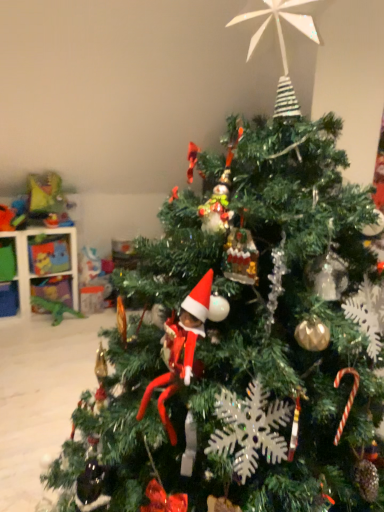
The height and width of the screenshot is (512, 384). What do you see at coordinates (44, 261) in the screenshot?
I see `white plastic shelf at left` at bounding box center [44, 261].

The height and width of the screenshot is (512, 384). What do you see at coordinates (41, 203) in the screenshot?
I see `plastic dinosaur at upper left, the first toy viewed from the top` at bounding box center [41, 203].

Find the location of a particular element. Image resolution: width=384 pixels, height=512 pixels. white plastic shelf at left is located at coordinates (44, 261).

Between plastic dinosaur at upper left, the first toy viewed from the top, and white plastic shelf at left, which one appears on the right side from the viewer's perspective?

plastic dinosaur at upper left, the first toy viewed from the top, is more to the right.

From a real-world perspective, is plastic dinosaur at upper left, the first toy viewed from the top, above or below white plastic shelf at left?

In terms of real-world spatial position, plastic dinosaur at upper left, the first toy viewed from the top, is above white plastic shelf at left.

Is plastic dinosaur at upper left, which ranks as the second toy in bottom-to-top order, completely or partially outside of white plastic shelf at left?

plastic dinosaur at upper left, which ranks as the second toy in bottom-to-top order, is positioned outside white plastic shelf at left.

How distant is plastic dinosaur at upper left, which ranks as the second toy in bottom-to-top order, from white plastic shelf at left?

plastic dinosaur at upper left, which ranks as the second toy in bottom-to-top order, is 10.46 inches from white plastic shelf at left.

Is white plastic shelf at left situated inside plastic dinosaur at upper left, which ranks as the second toy in bottom-to-top order, or outside?

white plastic shelf at left is located beyond the bounds of plastic dinosaur at upper left, which ranks as the second toy in bottom-to-top order.

Which object is thinner, white plastic shelf at left or plastic dinosaur at upper left, the first toy viewed from the top?

Thinner between the two is plastic dinosaur at upper left, the first toy viewed from the top.

Does point (13, 278) appear closer or farther from the camera than point (43, 204)?

Point (13, 278) is positioned closer to the camera compared to point (43, 204).

From the image's perspective, does white plastic shelf at left appear lower than plastic dinosaur at upper left, which ranks as the second toy in bottom-to-top order?

Indeed, from the image's perspective, white plastic shelf at left is shown beneath plastic dinosaur at upper left, which ranks as the second toy in bottom-to-top order.

Can you tell me how much white plastic shelf at left and green plastic dinosaur at lower left, marked as the first toy in a bottom-to-top arrangement, differ in facing direction?

The angle between the facing direction of white plastic shelf at left and the facing direction of green plastic dinosaur at lower left, marked as the first toy in a bottom-to-top arrangement, is 0.976 degrees.

Is point (35, 254) closer to viewer compared to point (54, 310)?

That is True.

Considering the sizes of white plastic shelf at left and green plastic dinosaur at lower left, marked as the first toy in a bottom-to-top arrangement, in the image, is white plastic shelf at left taller or shorter than green plastic dinosaur at lower left, marked as the first toy in a bottom-to-top arrangement,?

Considering their sizes, white plastic shelf at left has more height than green plastic dinosaur at lower left, marked as the first toy in a bottom-to-top arrangement.

Considering the relative positions of white plastic shelf at left and green plastic dinosaur at lower left, the 2th toy positioned from the top, in the image provided, is white plastic shelf at left to the right of green plastic dinosaur at lower left, the 2th toy positioned from the top, from the viewer's perspective?

Incorrect, white plastic shelf at left is not on the right side of green plastic dinosaur at lower left, the 2th toy positioned from the top.

Considering the relative positions of green plastic dinosaur at lower left, marked as the first toy in a bottom-to-top arrangement, and white plastic shelf at left in the image provided, is green plastic dinosaur at lower left, marked as the first toy in a bottom-to-top arrangement, to the left or to the right of white plastic shelf at left?

From the image, it's evident that green plastic dinosaur at lower left, marked as the first toy in a bottom-to-top arrangement, is to the right of white plastic shelf at left.

Is green plastic dinosaur at lower left, the 2th toy positioned from the top, positioned far away from white plastic shelf at left?

green plastic dinosaur at lower left, the 2th toy positioned from the top, is actually quite close to white plastic shelf at left.

Which object is wider, green plastic dinosaur at lower left, the 2th toy positioned from the top, or white plastic shelf at left?

white plastic shelf at left is wider.

Considering the relative positions of green plastic dinosaur at lower left, the 2th toy positioned from the top, and white plastic shelf at left in the image provided, is green plastic dinosaur at lower left, the 2th toy positioned from the top, behind white plastic shelf at left?

Yes, green plastic dinosaur at lower left, the 2th toy positioned from the top, is further from the camera.

Would you say plastic dinosaur at upper left, which ranks as the second toy in bottom-to-top order, contains green plastic dinosaur at lower left, the 2th toy positioned from the top?

Actually, green plastic dinosaur at lower left, the 2th toy positioned from the top, is outside plastic dinosaur at upper left, which ranks as the second toy in bottom-to-top order.

You are a GUI agent. You are given a task and a screenshot of the screen. Output one action in this format:
    pyautogui.click(x=<x>, y=<y>)
    Task: Click on the toy below the plastic dinosaur at upper left, the first toy viewed from the top (from a real-world perspective)
    The height and width of the screenshot is (512, 384).
    Given the screenshot: What is the action you would take?
    pyautogui.click(x=54, y=309)

How far apart are plastic dinosaur at upper left, which ranks as the second toy in bottom-to-top order, and green plastic dinosaur at lower left, the 2th toy positioned from the top?

plastic dinosaur at upper left, which ranks as the second toy in bottom-to-top order, is 29.17 inches from green plastic dinosaur at lower left, the 2th toy positioned from the top.

Is plastic dinosaur at upper left, the first toy viewed from the top, positioned far away from green plastic dinosaur at lower left, marked as the first toy in a bottom-to-top arrangement?

No, plastic dinosaur at upper left, the first toy viewed from the top, is not far away from green plastic dinosaur at lower left, marked as the first toy in a bottom-to-top arrangement.

Is green plastic dinosaur at lower left, marked as the first toy in a bottom-to-top arrangement, facing away from plastic dinosaur at upper left, which ranks as the second toy in bottom-to-top order?

green plastic dinosaur at lower left, marked as the first toy in a bottom-to-top arrangement, is not turned away from plastic dinosaur at upper left, which ranks as the second toy in bottom-to-top order.

From a real-world perspective, is green plastic dinosaur at lower left, marked as the first toy in a bottom-to-top arrangement, above or below plastic dinosaur at upper left, which ranks as the second toy in bottom-to-top order?

In terms of real-world spatial position, green plastic dinosaur at lower left, marked as the first toy in a bottom-to-top arrangement, is below plastic dinosaur at upper left, which ranks as the second toy in bottom-to-top order.

Where is `toy on the left of green plastic dinosaur at lower left, marked as the first toy in a bottom-to-top arrangement`? The image size is (384, 512). toy on the left of green plastic dinosaur at lower left, marked as the first toy in a bottom-to-top arrangement is located at coordinates [x=41, y=203].

Measure the distance from green plastic dinosaur at lower left, marked as the first toy in a bottom-to-top arrangement, to plastic dinosaur at upper left, the first toy viewed from the top.

green plastic dinosaur at lower left, marked as the first toy in a bottom-to-top arrangement, is 74.09 centimeters away from plastic dinosaur at upper left, the first toy viewed from the top.

Locate an element on the screen. This screenshot has height=512, width=384. shelf that is on the left side of plastic dinosaur at upper left, which ranks as the second toy in bottom-to-top order is located at coordinates (44, 261).

Find the location of a particular element. This screenshot has height=512, width=384. shelf below the plastic dinosaur at upper left, which ranks as the second toy in bottom-to-top order (from the image's perspective) is located at coordinates (44, 261).

Looking at the image, which one is located closer to white plastic shelf at left, plastic dinosaur at upper left, which ranks as the second toy in bottom-to-top order, or green plastic dinosaur at lower left, the 2th toy positioned from the top?

The object closer to white plastic shelf at left is plastic dinosaur at upper left, which ranks as the second toy in bottom-to-top order.

In the scene shown: When comparing their distances from green plastic dinosaur at lower left, the 2th toy positioned from the top, does plastic dinosaur at upper left, the first toy viewed from the top, or white plastic shelf at left seem closer?

Based on the image, white plastic shelf at left appears to be nearer to green plastic dinosaur at lower left, the 2th toy positioned from the top.

Which object lies nearer to the anchor point plastic dinosaur at upper left, the first toy viewed from the top, white plastic shelf at left or green plastic dinosaur at lower left, the 2th toy positioned from the top?

white plastic shelf at left is positioned closer to the anchor plastic dinosaur at upper left, the first toy viewed from the top.

When comparing their distances from white plastic shelf at left, does green plastic dinosaur at lower left, the 2th toy positioned from the top, or plastic dinosaur at upper left, which ranks as the second toy in bottom-to-top order, seem further?

Among the two, green plastic dinosaur at lower left, the 2th toy positioned from the top, is located further to white plastic shelf at left.

Estimate the real-world distances between objects in this image. Which object is further from green plastic dinosaur at lower left, marked as the first toy in a bottom-to-top arrangement, white plastic shelf at left or plastic dinosaur at upper left, the first toy viewed from the top?

plastic dinosaur at upper left, the first toy viewed from the top, is further to green plastic dinosaur at lower left, marked as the first toy in a bottom-to-top arrangement.

Which object lies further to the anchor point plastic dinosaur at upper left, the first toy viewed from the top, green plastic dinosaur at lower left, marked as the first toy in a bottom-to-top arrangement, or white plastic shelf at left?

Among the two, green plastic dinosaur at lower left, marked as the first toy in a bottom-to-top arrangement, is located further to plastic dinosaur at upper left, the first toy viewed from the top.

You are a GUI agent. You are given a task and a screenshot of the screen. Output one action in this format:
    pyautogui.click(x=<x>, y=<y>)
    Task: Click on the shelf between plastic dinosaur at upper left, which ranks as the second toy in bottom-to-top order, and green plastic dinosaur at lower left, the 2th toy positioned from the top, in the up-down direction
    Image resolution: width=384 pixels, height=512 pixels.
    Given the screenshot: What is the action you would take?
    pyautogui.click(x=44, y=261)